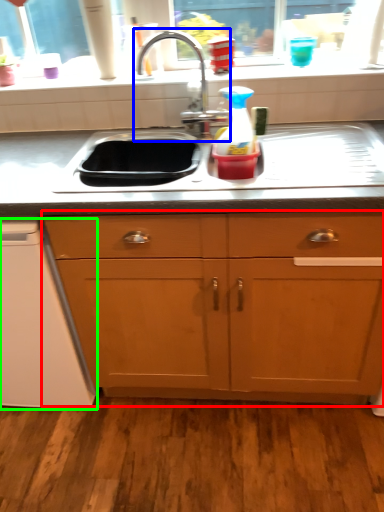
Question: Considering the real-world distances, which object is farthest from cabinetry (highlighted by a red box)? tap (highlighted by a blue box) or dish washer (highlighted by a green box)?

Choices:
 (A) tap
 (B) dish washer

Answer: (A)